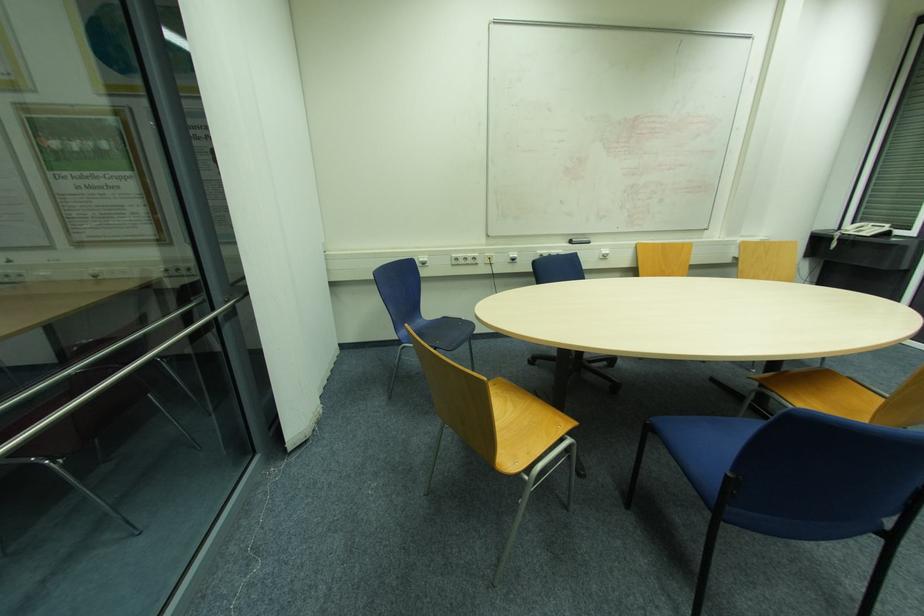
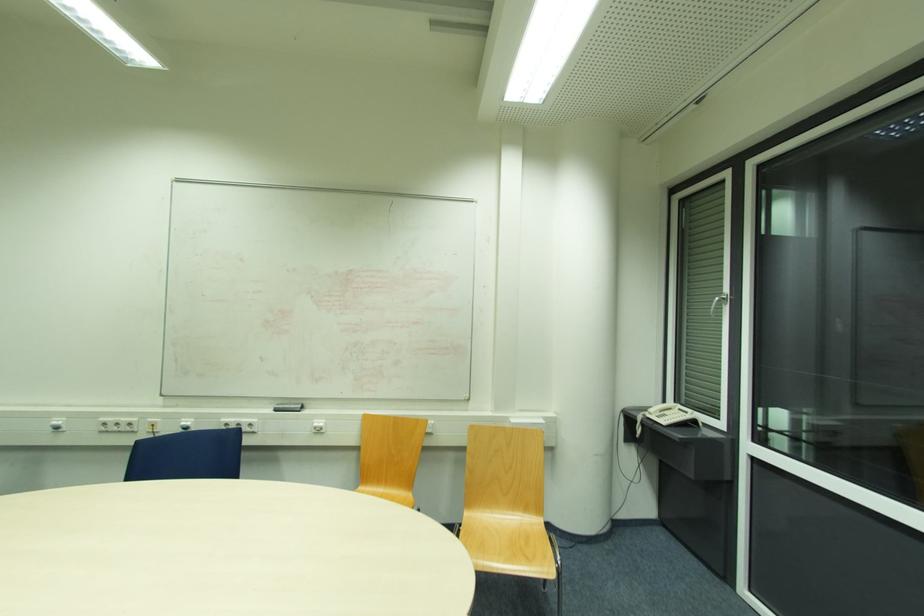
In the second image, find the point that corresponds to point 574,244 in the first image.

(276, 411)